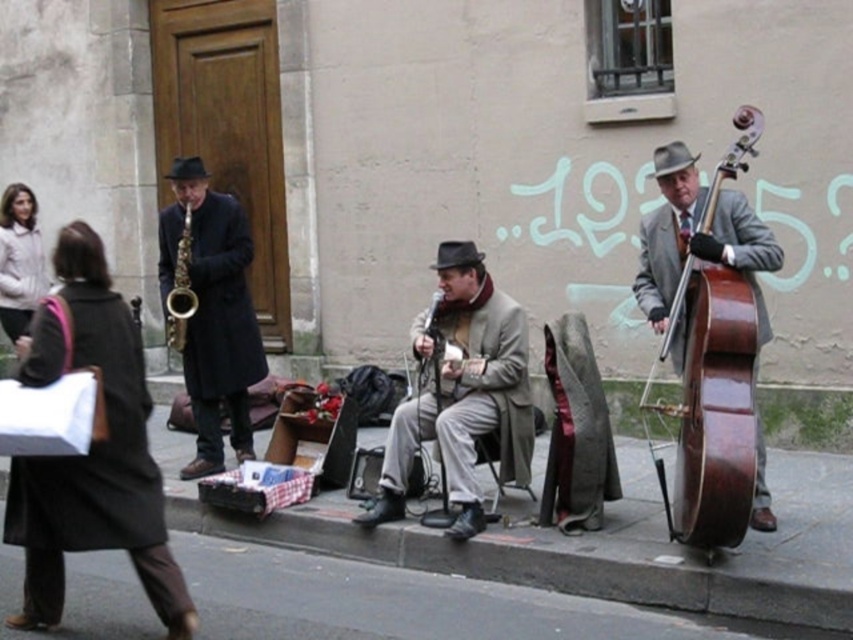
You are a street performer who needs to set up a large amplifier. The amplifier is too heavy to carry, so you must place it on the smooth asphalt pavement at lower center or the gold metallic saxophone at left. Which surface can support the amplifier?

The smooth asphalt pavement at lower center is bigger than the gold metallic saxophone at left, so it can support the amplifier better.

You are a photographer trying to capture the saxophone players in the street performance. Since there are two saxophones visible, which one is closer to the camera, the shiny gold saxophone at left or the gold metallic saxophone at left?

The shiny gold saxophone at left is closer to the camera because the gold metallic saxophone at left is behind it.

You are a street performer who needs to set up a small amplifier. The amplifier is 1.2 meters wide. You have space on the smooth asphalt pavement at lower center and the shiny gold saxophone at left. Which location can accommodate the amplifier?

The smooth asphalt pavement at lower center can accommodate the amplifier since its width is larger than the shiny gold saxophone at left, which is narrower and cannot fit the 1.2 meter wide amplifier.